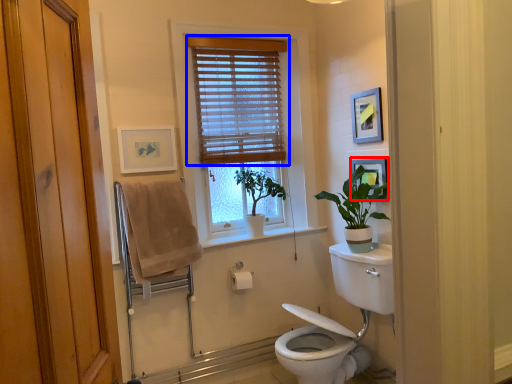
Question: Among these objects, which one is nearest to the camera, picture frame (highlighted by a red box) or window blind (highlighted by a blue box)?

Choices:
 (A) picture frame
 (B) window blind

Answer: (A)